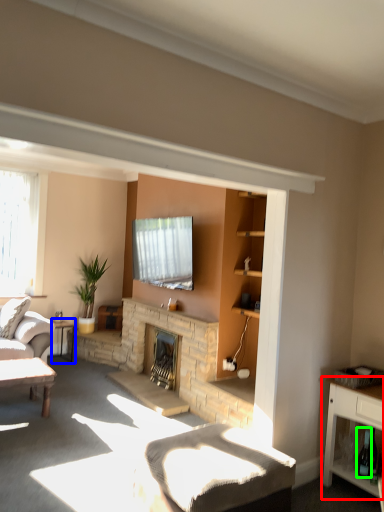
Question: Which object is positioned farthest from cabinetry (highlighted by a red box)? Select from table (highlighted by a blue box) and wine bottle (highlighted by a green box).

Choices:
 (A) table
 (B) wine bottle

Answer: (A)